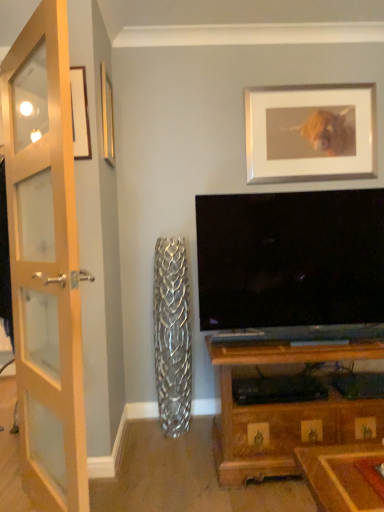
Question: Considering the relative sizes of wooden glass door at left and wooden picture frame at upper left, which ranks as the first picture frame in left-to-right order, in the image provided, is wooden glass door at left shorter than wooden picture frame at upper left, which ranks as the first picture frame in left-to-right order,?

Choices:
 (A) no
 (B) yes

Answer: (A)

Question: From the image's perspective, is wooden glass door at left over wooden picture frame at upper left, the second picture frame when ordered from back to front?

Choices:
 (A) no
 (B) yes

Answer: (A)

Question: Can you confirm if wooden glass door at left is taller than wooden picture frame at upper left, the second picture frame when ordered from back to front?

Choices:
 (A) yes
 (B) no

Answer: (A)

Question: Is wooden glass door at left aimed at wooden picture frame at upper left, which ranks as the first picture frame in left-to-right order?

Choices:
 (A) no
 (B) yes

Answer: (A)

Question: Is wooden glass door at left at the left side of wooden picture frame at upper left, placed as the second picture frame when sorted from right to left?

Choices:
 (A) no
 (B) yes

Answer: (B)

Question: Is wooden glass door at left positioned beyond the bounds of wooden picture frame at upper left, which ranks as the first picture frame in left-to-right order?

Choices:
 (A) yes
 (B) no

Answer: (A)

Question: From the image's perspective, is silver/metallic picture frame at upper center, which ranks as the first picture frame in back-to-front order, over wooden picture frame at upper left, the second picture frame when ordered from back to front?

Choices:
 (A) no
 (B) yes

Answer: (B)

Question: Does silver/metallic picture frame at upper center, the first picture frame when ordered from right to left, have a smaller size compared to wooden picture frame at upper left, which ranks as the first picture frame in left-to-right order?

Choices:
 (A) no
 (B) yes

Answer: (A)

Question: Can you confirm if silver/metallic picture frame at upper center, the 2th picture frame in the left-to-right sequence, is bigger than wooden picture frame at upper left, which ranks as the first picture frame in left-to-right order?

Choices:
 (A) no
 (B) yes

Answer: (B)

Question: Can you confirm if silver/metallic picture frame at upper center, the first picture frame when ordered from right to left, is positioned to the left of wooden picture frame at upper left, the second picture frame when ordered from back to front?

Choices:
 (A) yes
 (B) no

Answer: (B)

Question: Can wooden picture frame at upper left, the second picture frame when ordered from back to front, be found inside silver/metallic picture frame at upper center, which ranks as the first picture frame in back-to-front order?

Choices:
 (A) no
 (B) yes

Answer: (A)

Question: From a real-world perspective, is silver/metallic picture frame at upper center, the 2th picture frame in the left-to-right sequence, positioned under wooden picture frame at upper left, the 1th picture frame from the front, based on gravity?

Choices:
 (A) yes
 (B) no

Answer: (A)

Question: Is wooden glass door at left far away from silver/metallic picture frame at upper center, the 2th picture frame viewed from the front?

Choices:
 (A) no
 (B) yes

Answer: (B)